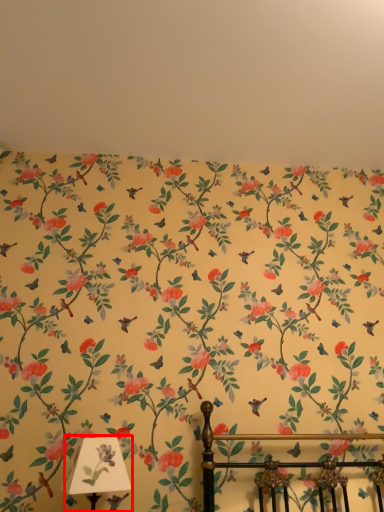
Question: From the image, what is the correct spatial relationship of table lamp (annotated by the red box) in relation to backdrop?

Choices:
 (A) right
 (B) left

Answer: (B)